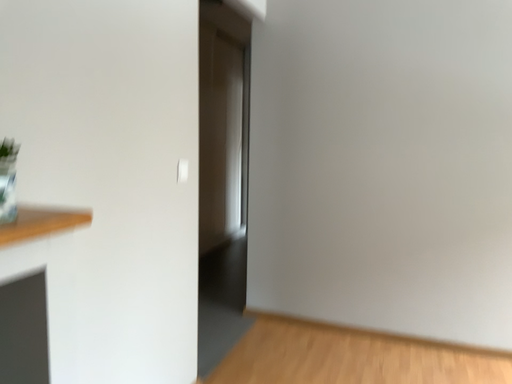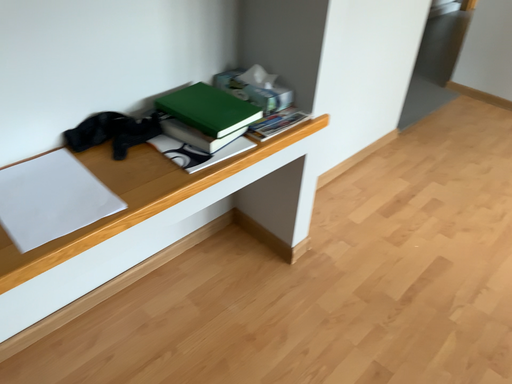
Question: How did the camera likely rotate when shooting the video?

Choices:
 (A) rotated right
 (B) rotated left

Answer: (B)